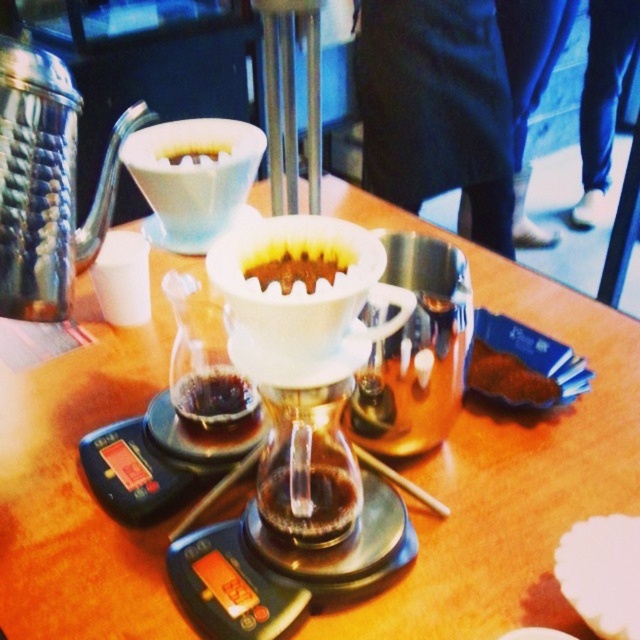
Question: Can you confirm if brown crumbly cookie at lower right is positioned above white matte coffee filter at center?

Choices:
 (A) no
 (B) yes

Answer: (A)

Question: Which point appears farthest from the camera in this image?

Choices:
 (A) (481, 355)
 (B) (288, 276)
 (C) (236, 563)

Answer: (A)

Question: Can you confirm if brushed metal teapot at left is positioned below brown crumbly cookie at lower right?

Choices:
 (A) no
 (B) yes

Answer: (A)

Question: Is translucent glass carafe at center smaller than transparent glass carafe at center?

Choices:
 (A) no
 (B) yes

Answer: (A)

Question: Among these points, which one is nearest to the camera?

Choices:
 (A) (28, 224)
 (B) (516, 396)

Answer: (A)

Question: Among these objects, which one is farthest from the camera?

Choices:
 (A) brushed metal teapot at left
 (B) white paper filter at center

Answer: (B)